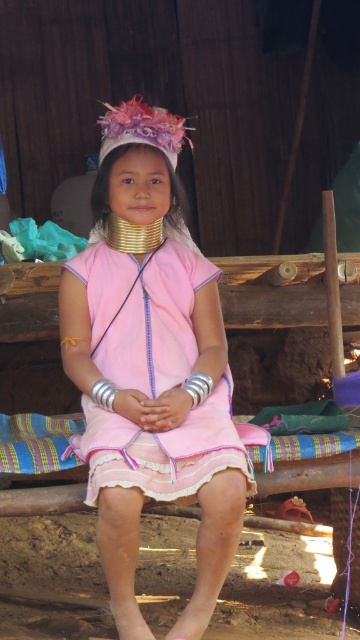
Question: Which of the following is the farthest from the observer?

Choices:
 (A) (146, 228)
 (B) (162, 436)
 (C) (141, 113)
 (D) (141, 352)

Answer: (A)

Question: Is pink matte dress at center closer to camera compared to fuzzy pink headdress at center?

Choices:
 (A) no
 (B) yes

Answer: (B)

Question: Which object appears closest to the camera in this image?

Choices:
 (A) pink matte dress at center
 (B) gold metallic neck piece at center
 (C) fuzzy pink headdress at center

Answer: (A)

Question: Among these objects, which one is farthest from the camera?

Choices:
 (A) fuzzy pink headdress at center
 (B) gold metallic neck piece at center
 (C) pink matte dress at center
 (D) pink satin dress at center

Answer: (B)

Question: Is pink satin dress at center in front of fuzzy pink headdress at center?

Choices:
 (A) no
 (B) yes

Answer: (B)

Question: Is fuzzy pink headdress at center further to the viewer compared to gold metallic neck piece at center?

Choices:
 (A) no
 (B) yes

Answer: (A)